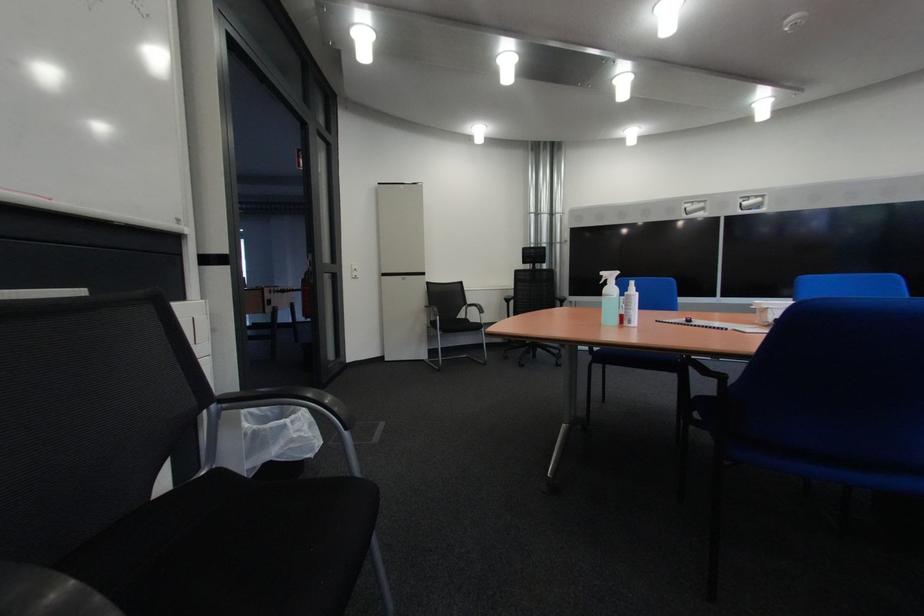
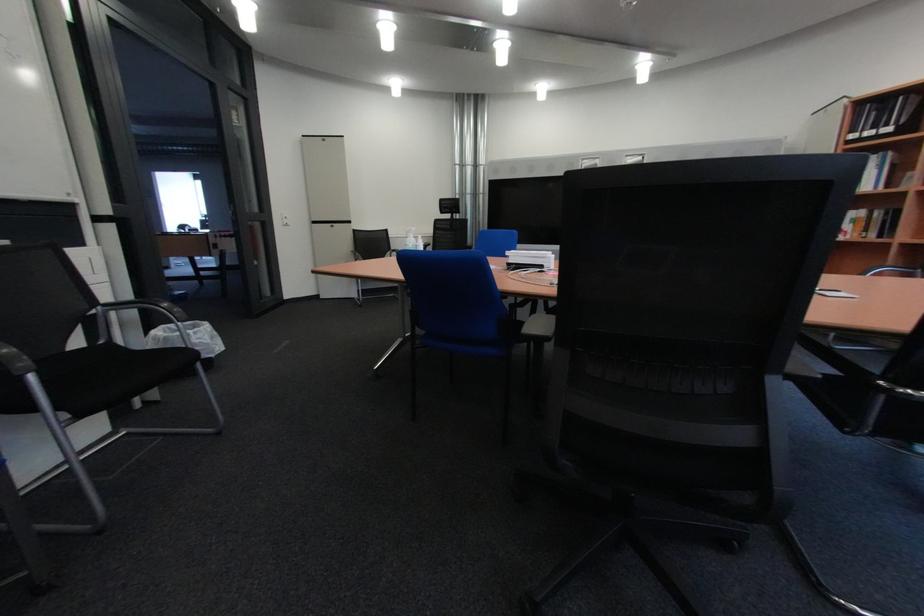
The images are taken continuously from a first-person perspective. In which direction are you moving?

The cameraman walked toward right, backward.